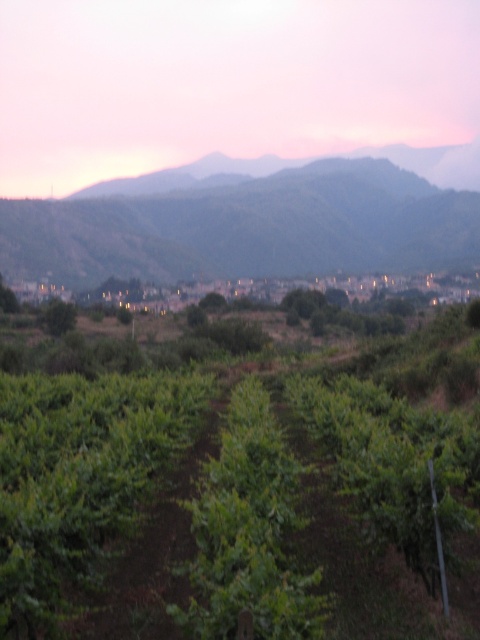
Is point (85, 595) positioned before point (288, 179)?

Yes, it is.

Can you confirm if green leafy vineyard at center is taller than green leafy hillside at center?

No.

Is point (230, 444) farther from camera compared to point (110, 273)?

No, (230, 444) is in front of (110, 273).

At what (x,y) coordinates should I click in order to perform the action: click on green leafy vineyard at center. Please return your answer as a coordinate pair (x, y). The height and width of the screenshot is (640, 480). Looking at the image, I should click on (241, 483).